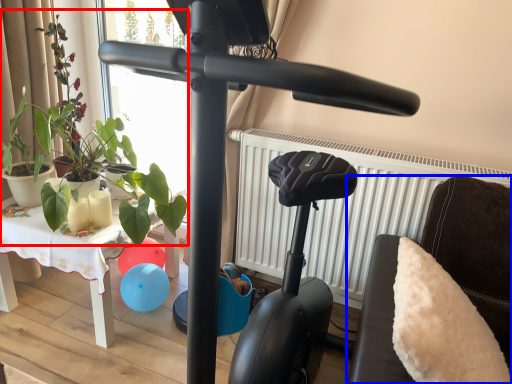
Question: Which object appears closest to the camera in this image, plant (highlighted by a red box) or furniture (highlighted by a blue box)?

Choices:
 (A) plant
 (B) furniture

Answer: (B)